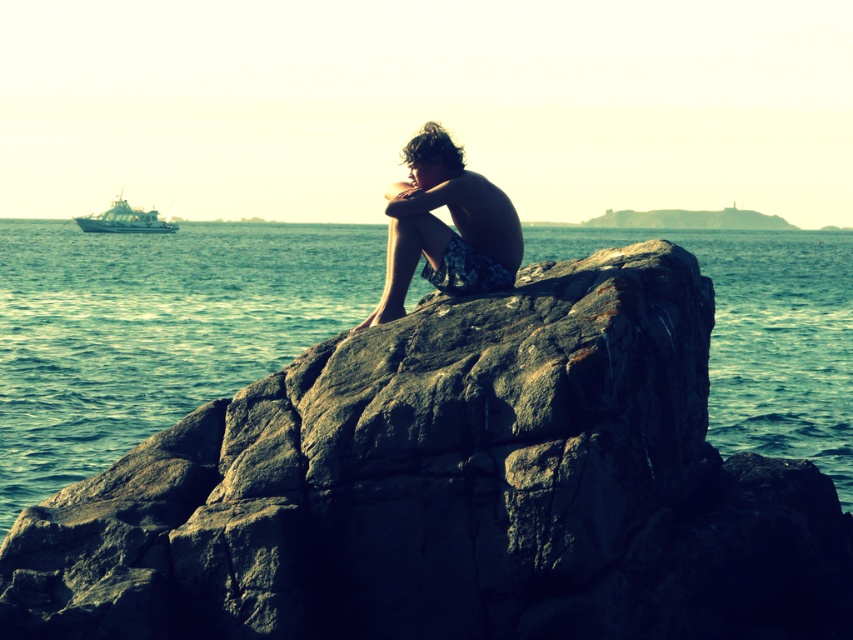
You are a photographer positioned at the center of the scene. You want to take a photo of the white matte boat at left while ensuring the floral shorts at center is visible in the background. Is this possible given their positions?

The floral shorts at center is located below the white matte boat at left, so if you position yourself to capture the white matte boat at left, the floral shorts at center would be below it in the frame, making it visible in the background.

You are standing on the rocky shore and want to place a small seashell between the blue water at center and the floral shorts at center. Based on their positions, which object should the seashell be closer to?

The seashell should be placed closer to the floral shorts at center because the blue water at center is closer to the viewer, meaning the floral shorts are farther away. To place the seashell between them, it needs to be closer to the farther object.

In the scene shown: You are a photographer trying to capture the scene of the person on the rock. Based on the image, which object, the blue water at center or the floral shorts at center, is positioned higher in the frame?

The blue water at center is taller than floral shorts at center, so the blue water at center is positioned higher in the frame.